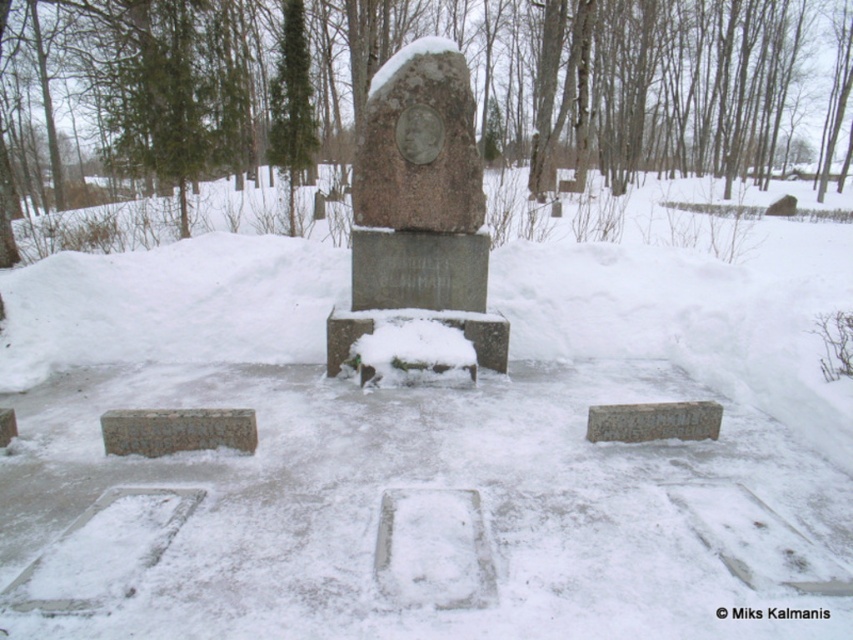
Question: Which object is closer to the camera taking this photo?

Choices:
 (A) granite statue at center
 (B) gray stone plaque at center
 (C) gray stone gravestone at lower left
 (D) gray stone plaque at lower left

Answer: (D)

Question: Can you confirm if granite statue at center is positioned below gray stone gravestone at lower left?

Choices:
 (A) yes
 (B) no

Answer: (B)

Question: Estimate the real-world distances between objects in this image. Which object is closer to the granite statue at center?

Choices:
 (A) gray stone gravestone at lower left
 (B) gray stone plaque at center
 (C) gray stone plaque at lower left

Answer: (B)

Question: Which point is farther from the camera taking this photo?

Choices:
 (A) (706, 433)
 (B) (418, 120)

Answer: (B)

Question: Can you confirm if granite statue at center is bigger than gray stone plaque at center?

Choices:
 (A) yes
 (B) no

Answer: (A)

Question: Can you confirm if gray stone plaque at center is positioned below gray stone gravestone at lower left?

Choices:
 (A) yes
 (B) no

Answer: (B)